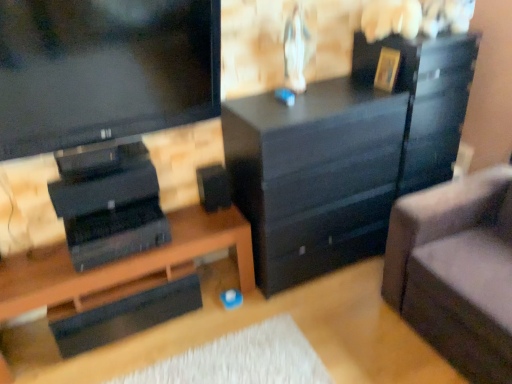
Where is `free region on the left part of black matte speaker at center`? free region on the left part of black matte speaker at center is located at coordinates (185, 214).